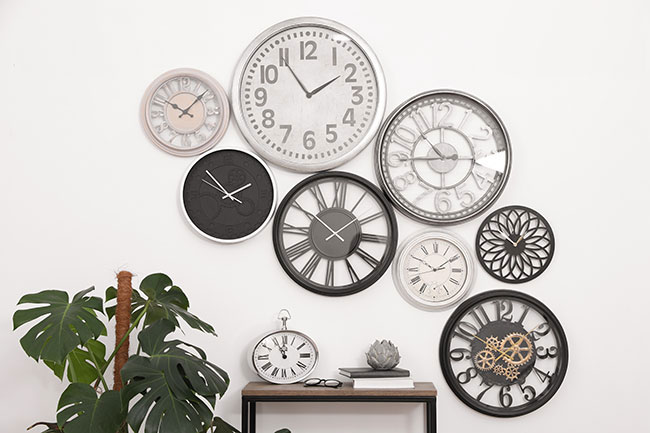
Identify the location of clock. (266, 349), (476, 348), (448, 272), (500, 255), (346, 230), (447, 173), (233, 195), (312, 102), (199, 92).